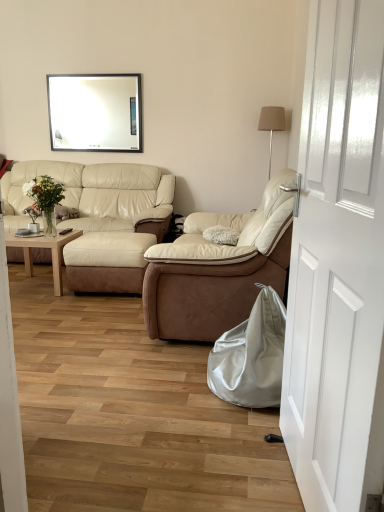
The height and width of the screenshot is (512, 384). What are the coordinates of `vacant space that's between beige leather recliner at center, which is the 2th studio couch from left to right, and satin silver bean bag at lower right` in the screenshot? It's located at (180, 366).